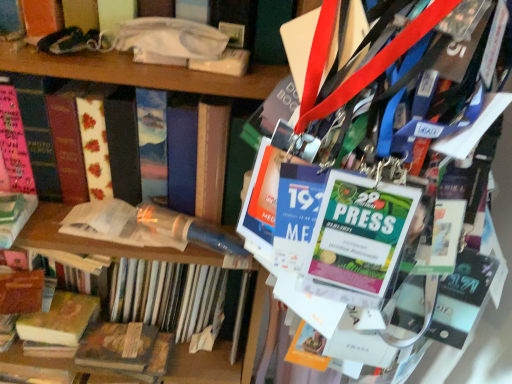
Question: Is hardcover book at left, which is counted as the 4th book, starting from the bottom, wider or thinner than yellow paperback book at lower left, which ranks as the 2th book in bottom-to-top order?

Choices:
 (A) wide
 (B) thin

Answer: (A)

Question: Considering the positions of hardcover book at left, which is counted as the 4th book, starting from the bottom, and yellow paperback book at lower left, which ranks as the 2th book in bottom-to-top order, in the image, is hardcover book at left, which is counted as the 4th book, starting from the bottom, bigger or smaller than yellow paperback book at lower left, which ranks as the 2th book in bottom-to-top order,?

Choices:
 (A) small
 (B) big

Answer: (B)

Question: Based on their relative distances, which object is nearer to the hardcover book at left, which is counted as the 4th book, starting from the bottom?

Choices:
 (A) wooden book at lower left, the fourth book when ordered from top to bottom
 (B) translucent plastic tube at center, which is counted as the 3th book, starting from the bottom
 (C) yellow paperback book at lower left, which ranks as the 2th book in bottom-to-top order

Answer: (B)

Question: Which object is positioned farthest from the yellow paperback book at lower left, which appears as the third book when viewed from the top?

Choices:
 (A) wooden book at lower left, which is the 1th book in bottom-to-top order
 (B) hardcover book at left, acting as the first book starting from the top
 (C) translucent plastic tube at center, which is counted as the 3th book, starting from the bottom

Answer: (B)